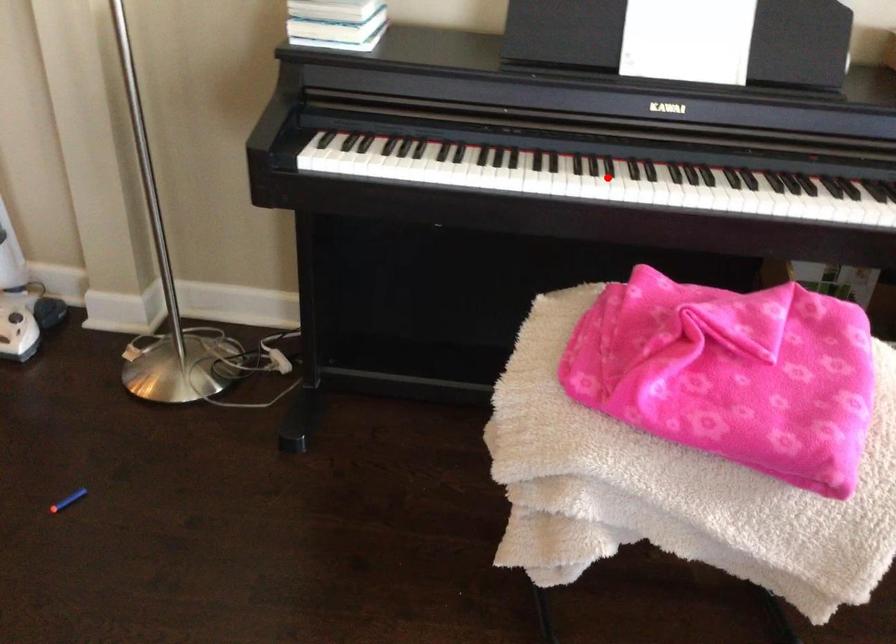
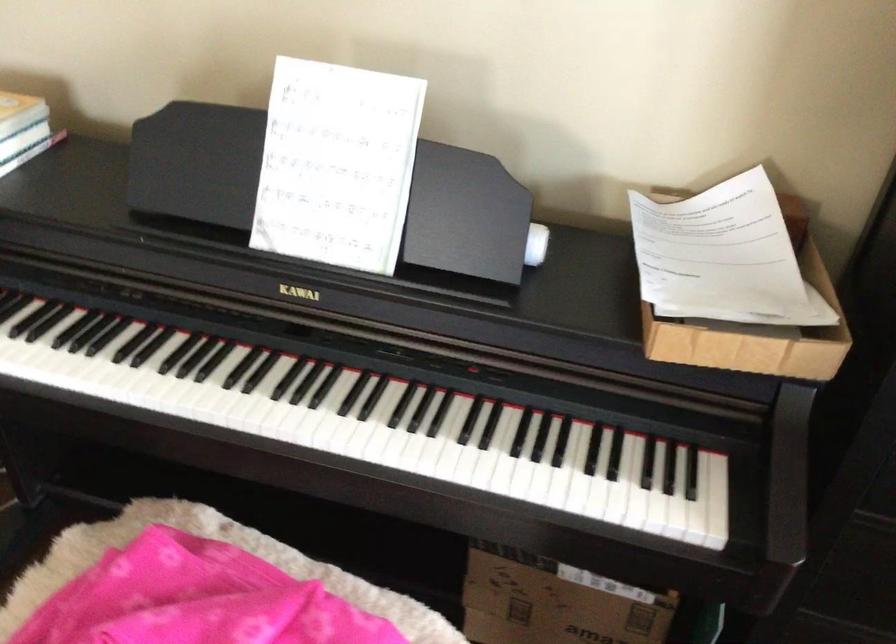
Question: I am providing you with two images of the same scene from different viewpoints. Image1 has a red point marked. In image2, the corresponding 3D location appears at what relative position? Reply with the corresponding letter.

Choices:
 (A) Closer
 (B) Farther

Answer: (A)